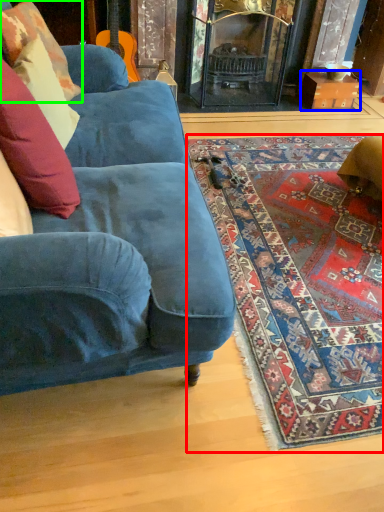
Question: Which is farther away from mat (highlighted by a red box)? cardboard box (highlighted by a blue box) or pillow (highlighted by a green box)?

Choices:
 (A) cardboard box
 (B) pillow

Answer: (A)